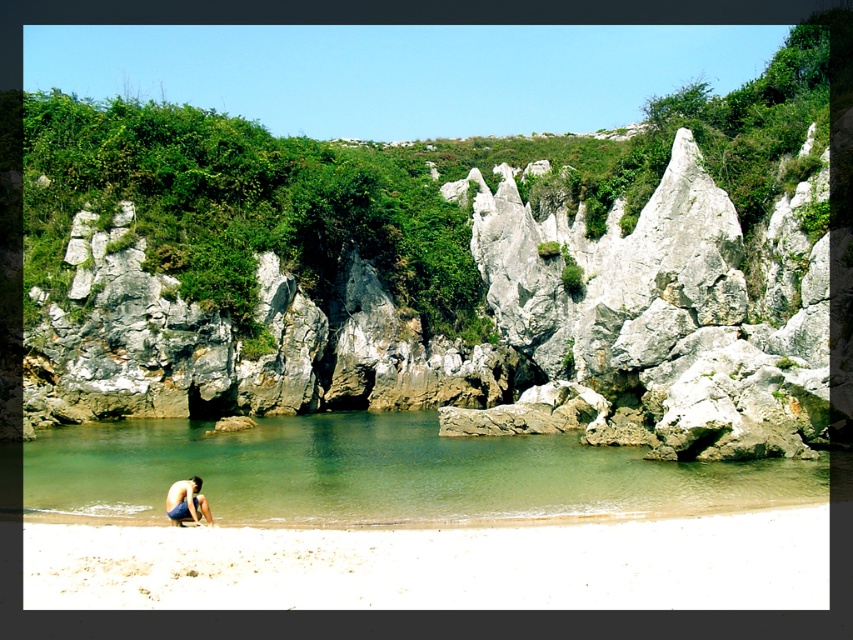
You are a hiker who wants to cross the beach to reach the rocky cliff. You see a point marked at coordinates (380,472). Is this point on the rocky cliff or on the clear water at beach center?

The point at coordinates (380,472) is on the clear water at beach center, so it is not on the rocky cliff. To reach the cliff, you need to avoid this area and head towards the rocky formations described in the scene.

You are standing on the sandy beach and want to wade into the clear water at beach center without getting your blue denim shorts at lower left wet. Is the water level low enough to do so?

The clear water at beach center is shorter than blue denim shorts at lower left, so yes, you can wade into the clear water at beach center without getting your blue denim shorts at lower left wet because the water is not tall enough to reach the shorts.

From the picture: You are standing on the cliff and want to reach the point marked as point (91, 531) on the beach. The cliff is 50 meters high. If you decide to walk down the cliff directly to the point, how far will you have to walk in total?

The total distance you will have to walk is the hypotenuse of a right triangle with legs of 37.01 meters and 50 meters. Using the Pythagorean theorem, the distance is sqrt 37.01 squared plus 50 squared, which is approximately sqrt 1369.9401 plus 2500 equals sqrt 3869.9401, which is approximately 62.2 meters.